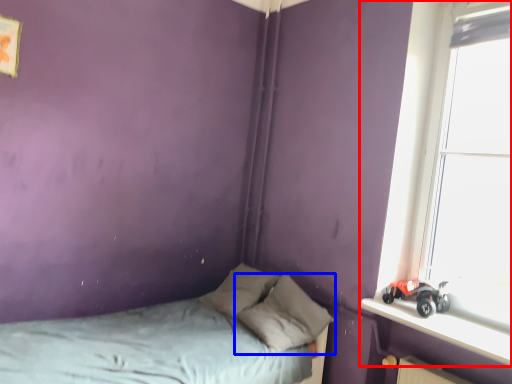
Question: Which object is closer to the camera taking this photo, window (highlighted by a red box) or pillow (highlighted by a blue box)?

Choices:
 (A) window
 (B) pillow

Answer: (A)